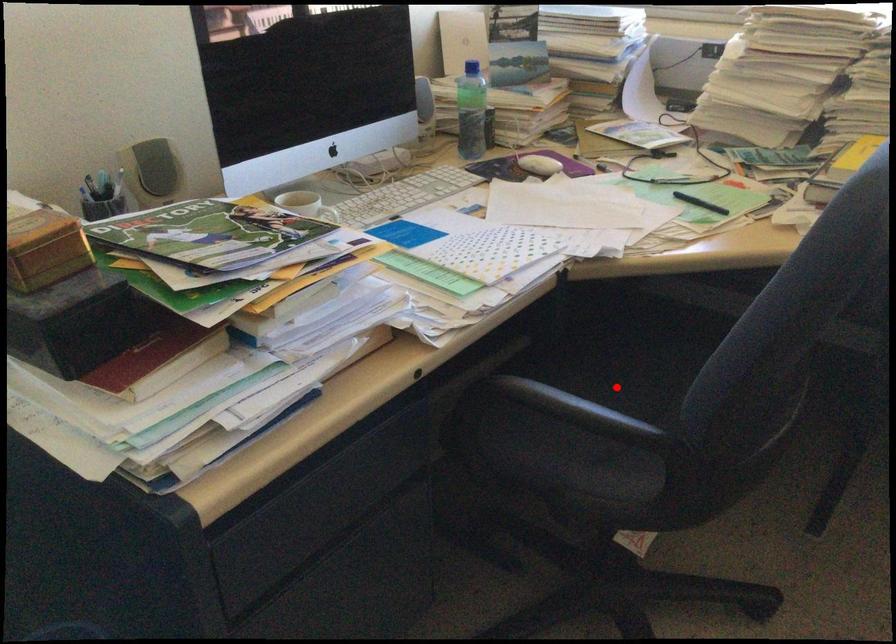
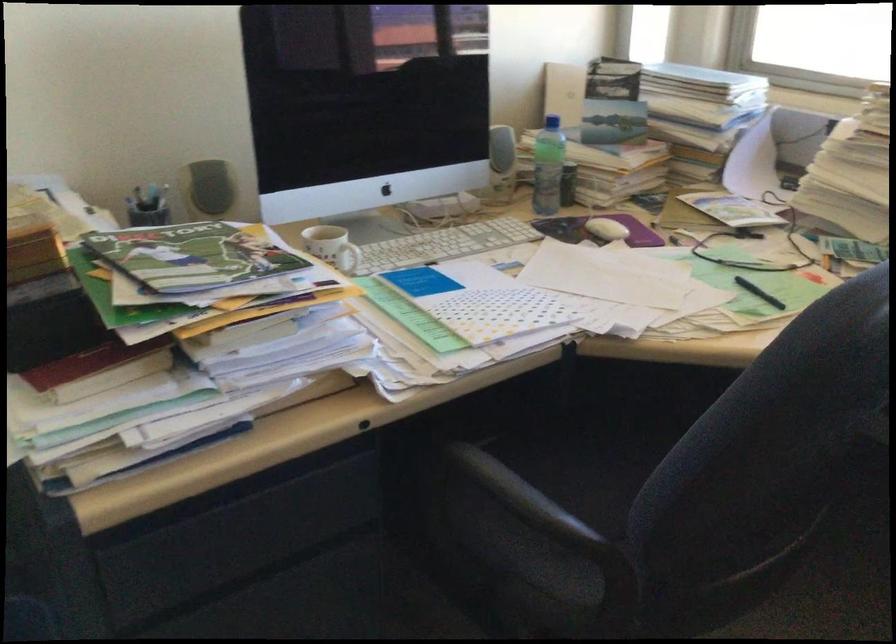
Locate, in the second image, the point that corresponds to the highlighted location in the first image.

(616, 478)